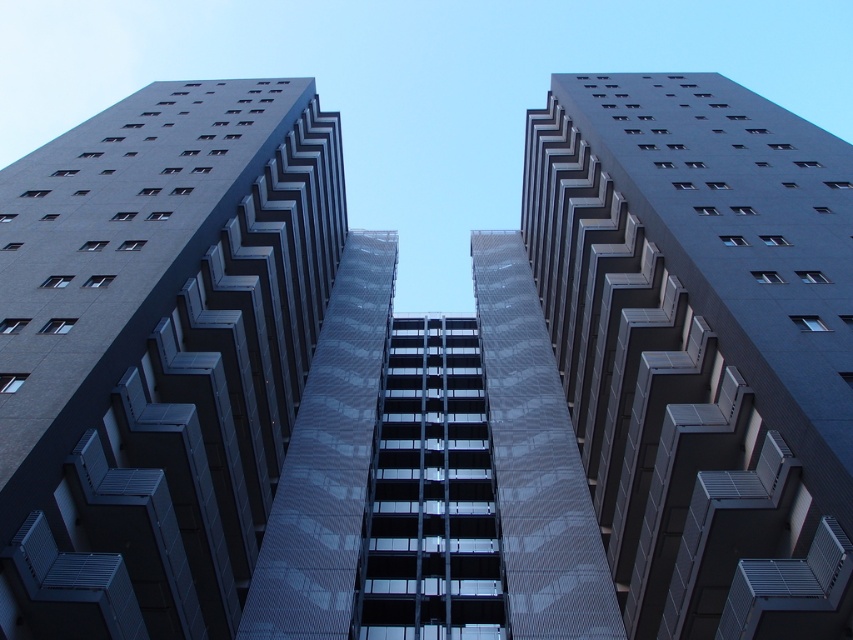
You are an architect reviewing the design of the three buildings. You notice that there are two central buildings labeled as smooth glass building at center and smooth concrete building at center. Which one is positioned to the left of the other?

The smooth glass building at center is to the left of smooth concrete building at center.

Based on the scene description, what is the significance of the point at coordinates (157, 352)?

The point at coordinates (157, 352) indicates the location of the smooth glass building at center.